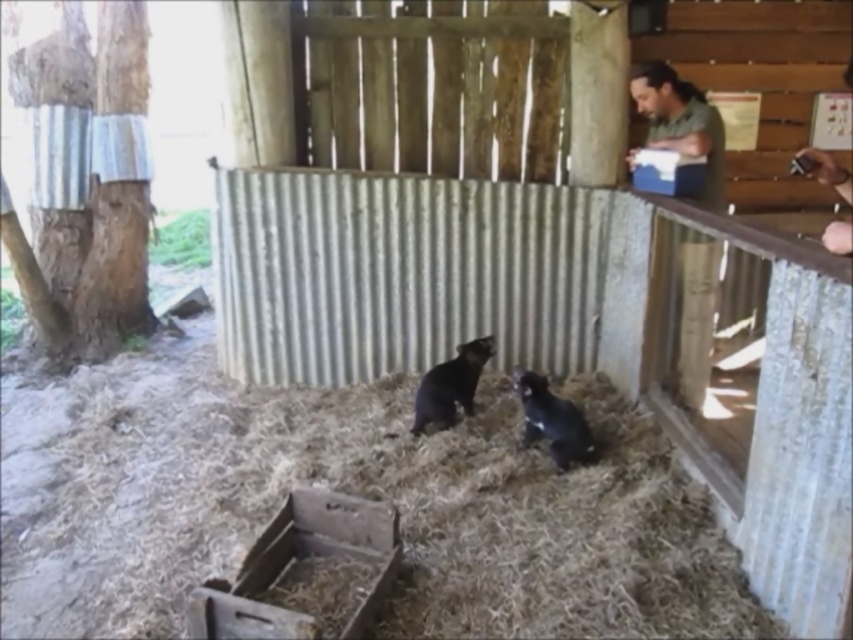
Is shiny black animal at center smaller than black furry tasmanian devil at center?

Correct, shiny black animal at center occupies less space than black furry tasmanian devil at center.

Who is shorter, shiny black animal at center or black furry tasmanian devil at center?

Standing shorter between the two is shiny black animal at center.

Measure the distance between shiny black animal at center and camera.

8.52 feet

Where is `shiny black animal at center`? shiny black animal at center is located at coordinates (550, 419).

Is green matte shirt at upper right positioned in front of black furry tasmanian devil at center?

That is True.

Is point (704, 324) positioned after point (471, 365)?

No, (704, 324) is closer to viewer.

The image size is (853, 640). Describe the element at coordinates (679, 120) in the screenshot. I see `green matte shirt at upper right` at that location.

The image size is (853, 640). In order to click on green matte shirt at upper right in this screenshot , I will do `click(679, 120)`.

From the picture: Between green matte shirt at upper right and shiny black animal at center, which one has more height?

green matte shirt at upper right

What do you see at coordinates (679, 120) in the screenshot?
I see `green matte shirt at upper right` at bounding box center [679, 120].

Who is more distant from viewer, (701, 330) or (561, 433)?

The point (701, 330) is more distant.

Where is `green matte shirt at upper right`? Image resolution: width=853 pixels, height=640 pixels. green matte shirt at upper right is located at coordinates (679, 120).